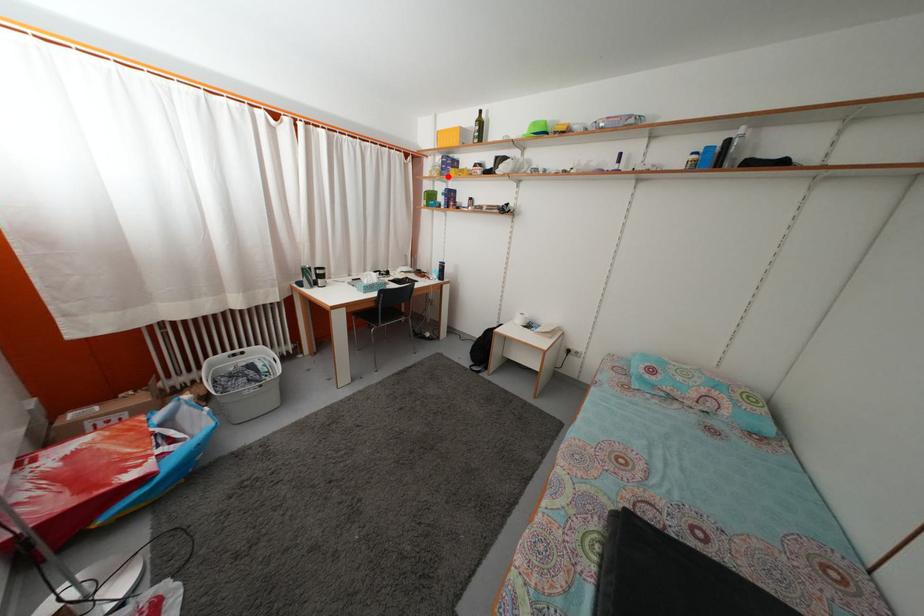
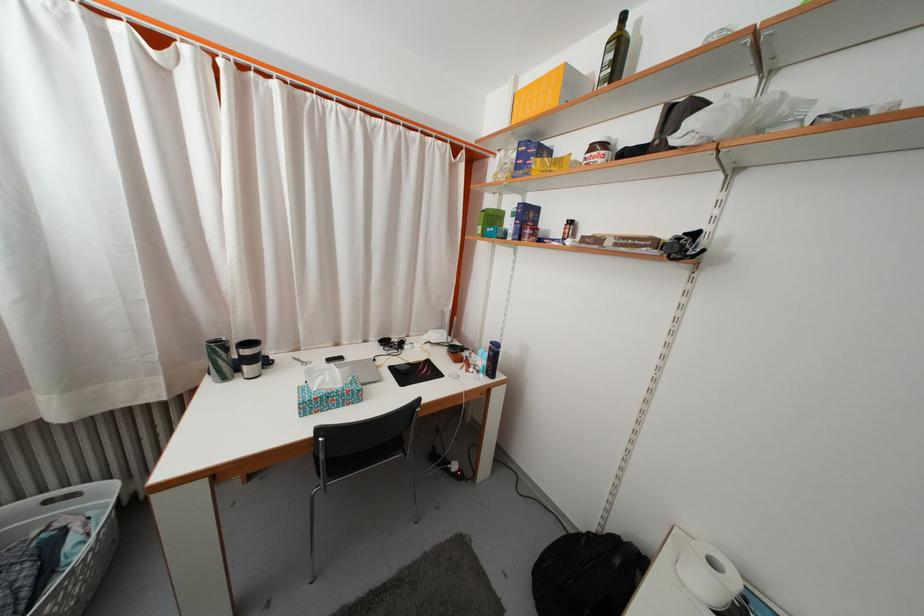
The point at the highlighted location is marked in the first image. Where is the corresponding point in the second image?

(523, 175)